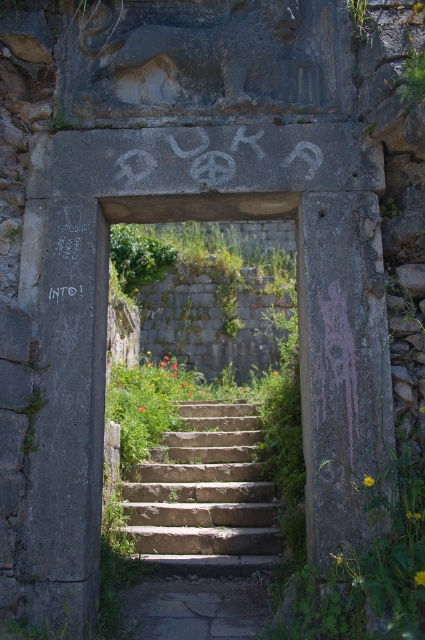
Question: Does stone steps at center have a greater width compared to natural stone stairs at center?

Choices:
 (A) no
 (B) yes

Answer: (B)

Question: From the image, what is the correct spatial relationship of stone steps at center in relation to natural stone stairs at center?

Choices:
 (A) right
 (B) left

Answer: (A)

Question: Among these objects, which one is nearest to the camera?

Choices:
 (A) natural stone stairs at center
 (B) stone steps at center

Answer: (B)

Question: Which point is closer to the camera?

Choices:
 (A) (271, 428)
 (B) (161, 564)

Answer: (B)

Question: Is stone steps at center closer to the viewer compared to natural stone stairs at center?

Choices:
 (A) no
 (B) yes

Answer: (B)